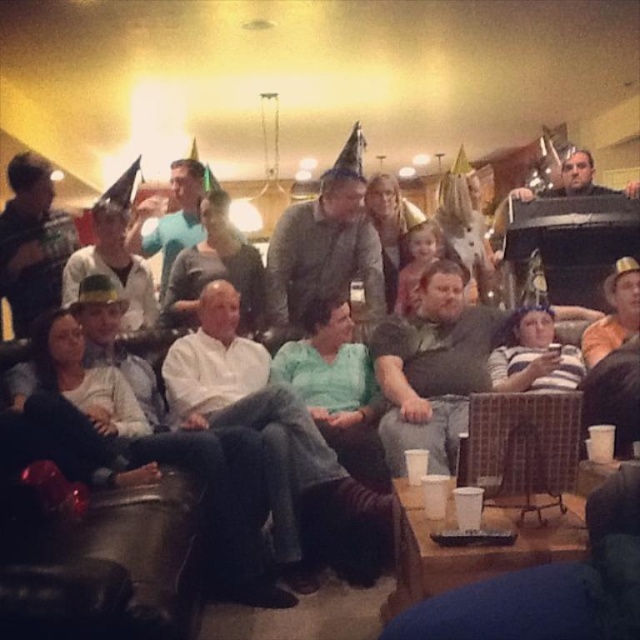
Question: Is white cotton shirt at center smaller than woven rattan armchair at lower center?

Choices:
 (A) yes
 (B) no

Answer: (B)

Question: Is white cotton shirt at center in front of dark gray sweater at center?

Choices:
 (A) no
 (B) yes

Answer: (A)

Question: Which of the following is the farthest from the observer?

Choices:
 (A) (61, 227)
 (B) (540, 401)

Answer: (A)

Question: Considering the relative positions of white cotton shirt at center and dark gray sweater at center in the image provided, where is white cotton shirt at center located with respect to dark gray sweater at center?

Choices:
 (A) above
 (B) below

Answer: (B)

Question: Which point appears farthest from the camera in this image?

Choices:
 (A) (480, 452)
 (B) (330, 288)

Answer: (B)

Question: Which point is closer to the camera taking this photo?

Choices:
 (A) (314, 534)
 (B) (51, 252)

Answer: (A)